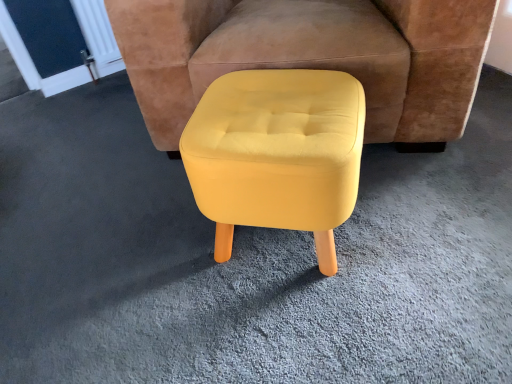
Question: Are yellow fabric stool at center and yellow fabric ottoman at center located far from each other?

Choices:
 (A) yes
 (B) no

Answer: (B)

Question: Considering the relative sizes of yellow fabric stool at center and yellow fabric ottoman at center in the image provided, is yellow fabric stool at center bigger than yellow fabric ottoman at center?

Choices:
 (A) no
 (B) yes

Answer: (A)

Question: Is yellow fabric stool at center at the left side of yellow fabric ottoman at center?

Choices:
 (A) no
 (B) yes

Answer: (B)

Question: From the image's perspective, is yellow fabric stool at center beneath yellow fabric ottoman at center?

Choices:
 (A) yes
 (B) no

Answer: (A)

Question: Can you confirm if yellow fabric stool at center is taller than yellow fabric ottoman at center?

Choices:
 (A) yes
 (B) no

Answer: (B)

Question: Can you confirm if yellow fabric stool at center is thinner than yellow fabric ottoman at center?

Choices:
 (A) yes
 (B) no

Answer: (A)

Question: Considering the relative sizes of yellow fabric ottoman at center and yellow fabric stool at center in the image provided, is yellow fabric ottoman at center thinner than yellow fabric stool at center?

Choices:
 (A) no
 (B) yes

Answer: (A)

Question: Can you confirm if yellow fabric ottoman at center is positioned to the right of yellow fabric stool at center?

Choices:
 (A) no
 (B) yes

Answer: (B)

Question: Does yellow fabric ottoman at center turn towards yellow fabric stool at center?

Choices:
 (A) no
 (B) yes

Answer: (B)

Question: Is yellow fabric ottoman at center taller than yellow fabric stool at center?

Choices:
 (A) yes
 (B) no

Answer: (A)

Question: Is yellow fabric ottoman at center placed right next to yellow fabric stool at center?

Choices:
 (A) yes
 (B) no

Answer: (B)

Question: Is the depth of yellow fabric ottoman at center less than that of yellow fabric stool at center?

Choices:
 (A) yes
 (B) no

Answer: (B)

Question: From a real-world perspective, relative to yellow fabric ottoman at center, is yellow fabric stool at center vertically above or below?

Choices:
 (A) below
 (B) above

Answer: (A)